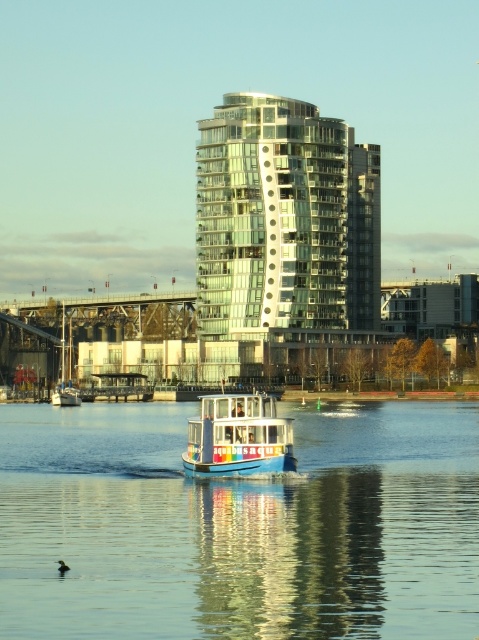
Question: Does blue glossy water at center have a larger size compared to blue painted wooden boat at center?

Choices:
 (A) no
 (B) yes

Answer: (B)

Question: Which of the following is the closest to the observer?

Choices:
 (A) glassy reflective building at center
 (B) blue painted wooden boat at center

Answer: (B)

Question: Which point is farther to the camera?

Choices:
 (A) (346, 243)
 (B) (68, 400)

Answer: (A)

Question: From the image, what is the correct spatial relationship of blue glossy water at center in relation to white glossy sailboat at left?

Choices:
 (A) left
 (B) right

Answer: (B)

Question: Does blue painted wooden boat at center have a larger size compared to white glossy sailboat at left?

Choices:
 (A) yes
 (B) no

Answer: (B)

Question: Which point is farther from the camera taking this photo?

Choices:
 (A) (232, 406)
 (B) (351, 470)
 (C) (66, 396)
 (D) (207, 200)

Answer: (D)